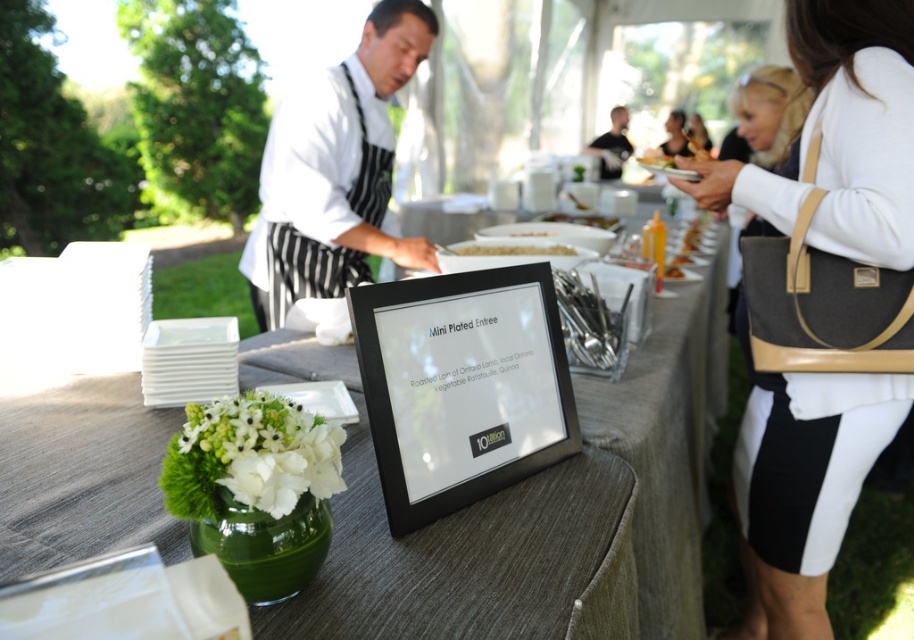
You are a guest at the event and want to place the golden brown bread at center on the smooth white plate at center. Can the bread fit on the plate?

The golden brown bread at center occupies less space than smooth white plate at center, so yes, the bread can fit on the plate.

In the scene shown: You are a guest at the event and want to read the menu card. You see the matte black frame at center and the white textured sweater at upper right. Which object is closer to your left side?

The matte black frame at center is to the left of white textured sweater at upper right, so it is closer to your left side.